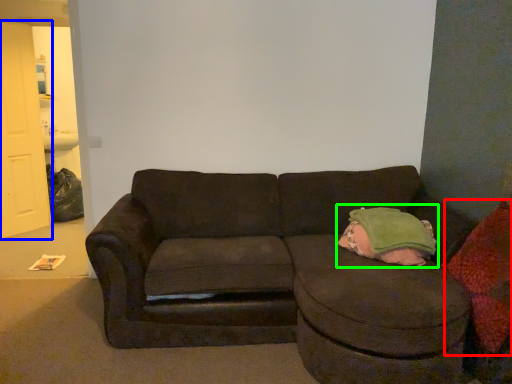
Question: Considering the real-world distances, which object is farthest from throw pillow (highlighted by a red box)? door (highlighted by a blue box) or bean bag chair (highlighted by a green box)?

Choices:
 (A) door
 (B) bean bag chair

Answer: (A)